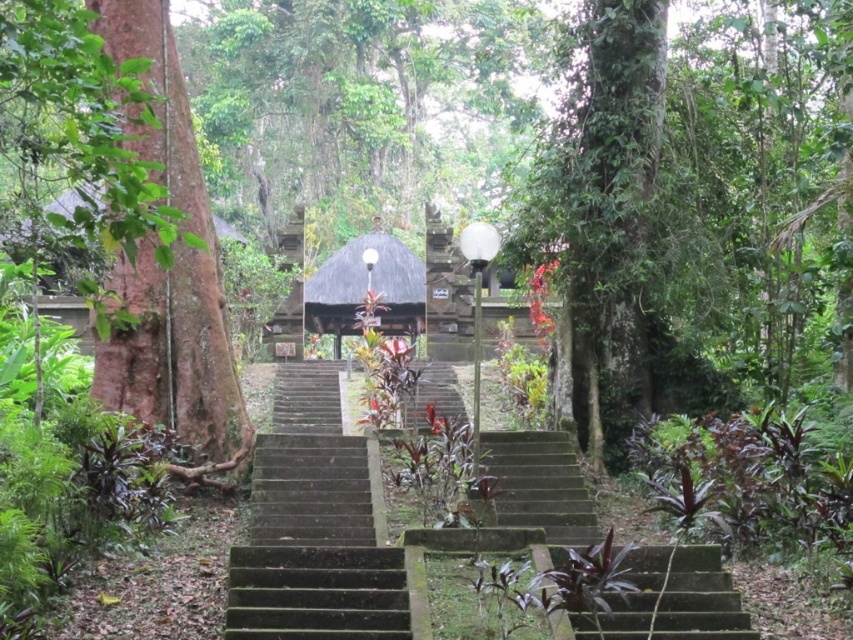
Question: Where is brown rough bark tree at left located in relation to green mossy stairs at lower center in the image?

Choices:
 (A) above
 (B) below

Answer: (A)

Question: Which point is farther to the camera?

Choices:
 (A) green mossy stairs at lower center
 (B) brown rough bark tree at left

Answer: (A)

Question: Can you confirm if brown rough bark tree at left is bigger than dark brown thatched hut at center?

Choices:
 (A) no
 (B) yes

Answer: (A)

Question: Observing the image, what is the correct spatial positioning of green stone stairs at center in reference to green mossy stairs at lower center?

Choices:
 (A) above
 (B) below

Answer: (A)

Question: Which object appears farthest from the camera in this image?

Choices:
 (A) dark gray stone stairs at center
 (B) green stone stairs at center

Answer: (A)

Question: Which of the following is the closest to the observer?

Choices:
 (A) (534, 483)
 (B) (668, 621)
 (C) (459, 410)
 (D) (186, 164)

Answer: (B)